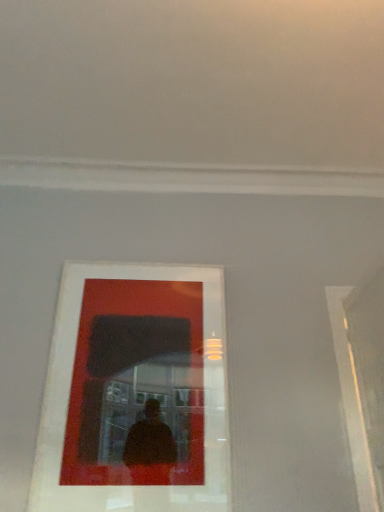
This screenshot has height=512, width=384. I want to click on matte glass picture frame at center, so click(x=135, y=392).

What do you see at coordinates (135, 392) in the screenshot?
I see `matte glass picture frame at center` at bounding box center [135, 392].

What is the approximate width of matte glass picture frame at center?

The width of matte glass picture frame at center is 1.22 inches.

You are a GUI agent. You are given a task and a screenshot of the screen. Output one action in this format:
    pyautogui.click(x=<x>, y=<y>)
    Task: Click on the matte glass picture frame at center
    The height and width of the screenshot is (512, 384).
    Given the screenshot: What is the action you would take?
    pyautogui.click(x=135, y=392)